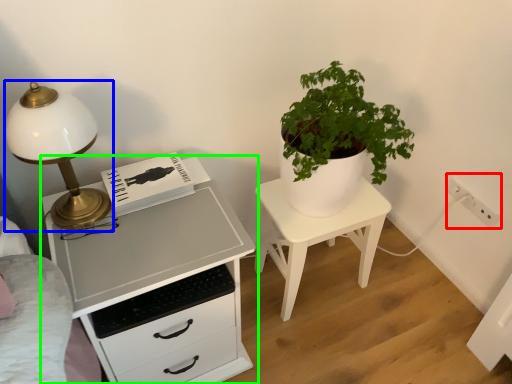
Question: Which object is positioned closest to electric outlet (highlighted by a red box)? Select from lamp (highlighted by a blue box) and chest of drawers (highlighted by a green box).

Choices:
 (A) lamp
 (B) chest of drawers

Answer: (B)